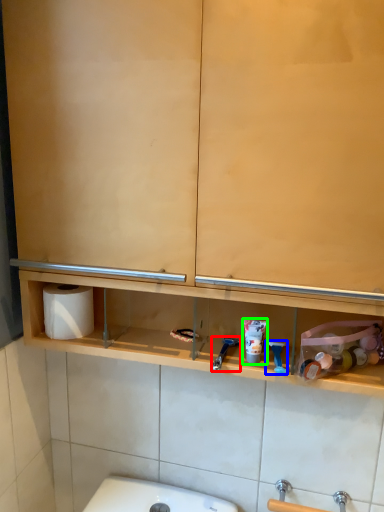
Question: Which is farther away from shower (highlighted by a red box)? shower (highlighted by a blue box) or shaving cream (highlighted by a green box)?

Choices:
 (A) shower
 (B) shaving cream

Answer: (A)